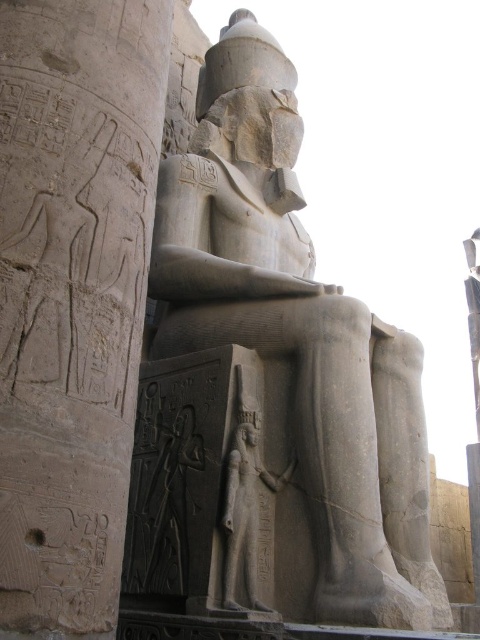
Question: Among these objects, which one is nearest to the camera?

Choices:
 (A) gray stone statue at center
 (B) gray stone hieroglyphics at center

Answer: (B)

Question: Is gray stone hieroglyphics at center wider than gray stone statue at center?

Choices:
 (A) no
 (B) yes

Answer: (A)

Question: Does gray stone hieroglyphics at center appear under gray stone statue at center?

Choices:
 (A) yes
 (B) no

Answer: (A)

Question: Which of the following is the closest to the observer?

Choices:
 (A) gray stone statue at center
 (B) gray stone hieroglyphics at center

Answer: (B)

Question: Is gray stone hieroglyphics at center positioned in front of gray stone statue at center?

Choices:
 (A) yes
 (B) no

Answer: (A)